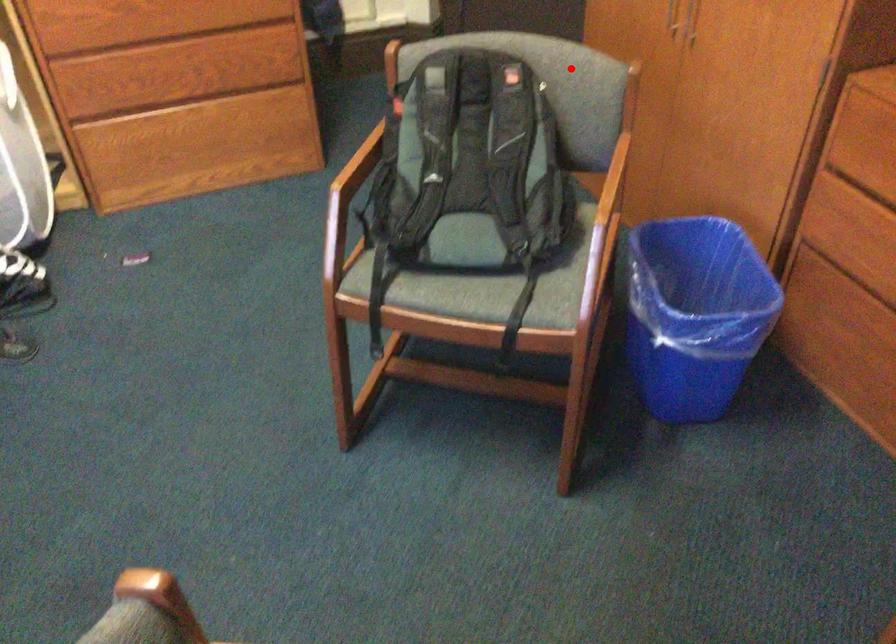
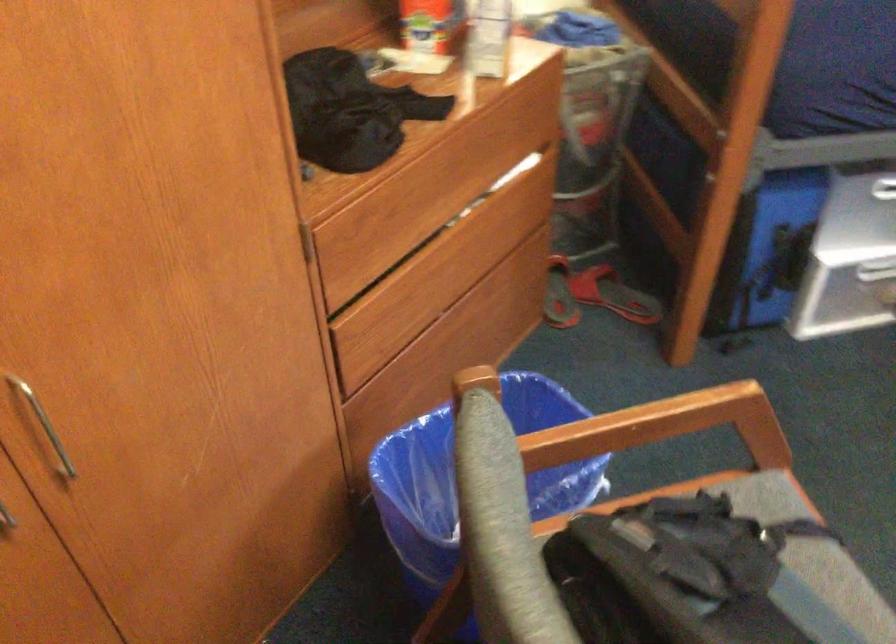
Where in the second image is the point corresponding to the highlighted location from the first image?

(471, 475)